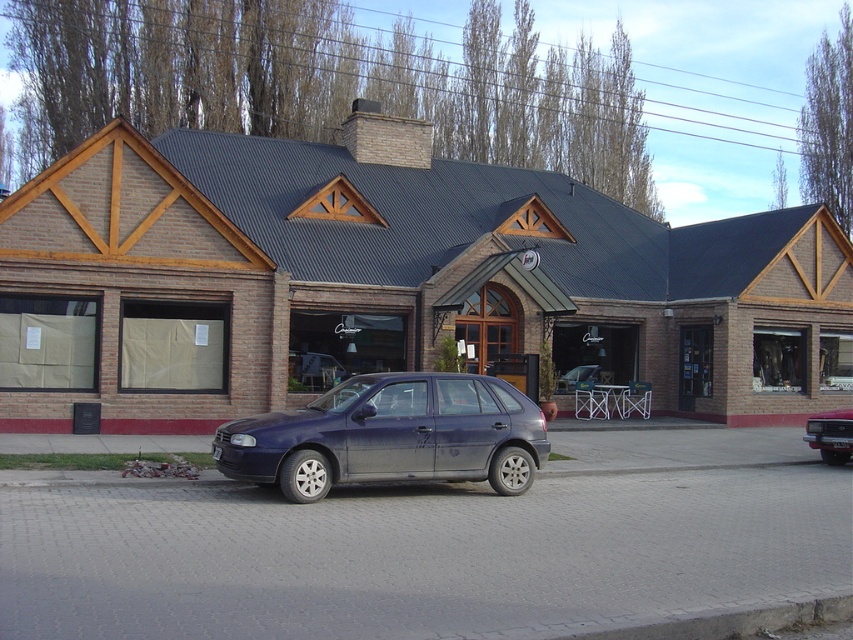
This screenshot has width=853, height=640. What do you see at coordinates (390, 435) in the screenshot?
I see `slate metallic car at center` at bounding box center [390, 435].

Is point (318, 404) in front of point (558, 380)?

That is True.

The image size is (853, 640). I want to click on slate metallic car at center, so click(390, 435).

Can you confirm if metallic silver car at center is positioned above satin silver sedan at center?

Actually, metallic silver car at center is below satin silver sedan at center.

Can you confirm if metallic silver car at center is taller than satin silver sedan at center?

Incorrect, metallic silver car at center's height is not larger of satin silver sedan at center's.

Does point (814, 417) come in front of point (581, 371)?

Yes, point (814, 417) is closer to viewer.

In order to click on metallic silver car at center in this screenshot , I will do [x=830, y=435].

Does brick building at center have a smaller size compared to satin silver sedan at center?

No, brick building at center is not smaller than satin silver sedan at center.

The image size is (853, 640). Identify the location of brick building at center. click(x=387, y=282).

At what (x,y) coordinates should I click in order to perform the action: click on brick building at center. Please return your answer as a coordinate pair (x, y). The height and width of the screenshot is (640, 853). Looking at the image, I should click on (387, 282).